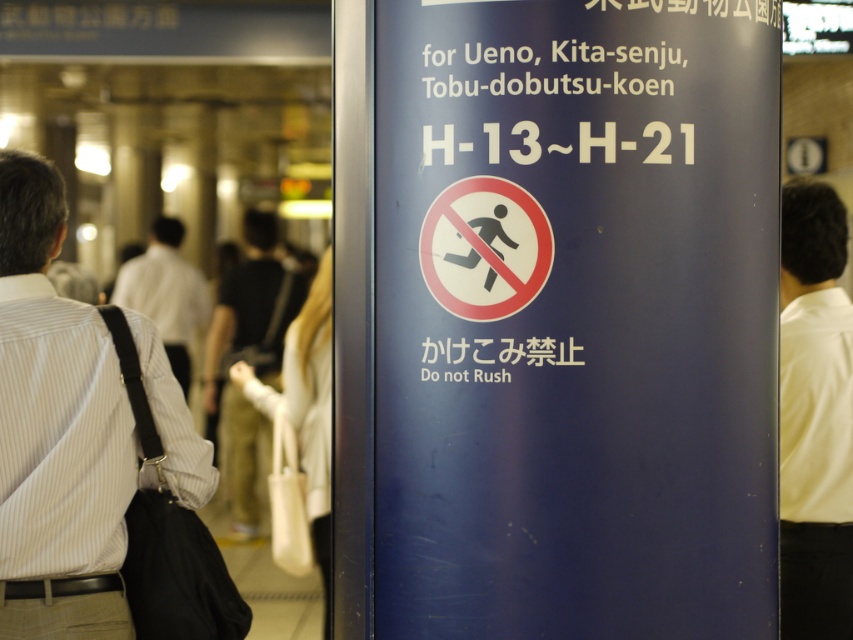
You are standing in a subway station and see a signboard with two people nearby. One is wearing a white striped shirt at left and the other a light brown leather jacket at center. According to their positions, which person is closer to the signboard?

The light brown leather jacket at center is closer to the signboard because the white striped shirt at left is positioned to the right of the light brown leather jacket at center, meaning the jacket is nearer to the signboard.

You are standing in a subway station and see a signboard with a white shirt at right and a light brown leather jacket at center. Which clothing item is closer to the top of the signboard?

The white shirt at right is positioned over the light brown leather jacket at center, so it is closer to the top of the signboard.

You are standing at the entrance of the subway station and see a signboard with a dark blue background. On the left side of the signboard, there is a white striped shirt at left, and at the center, there is a light brown leather jacket at center. If you want to place a small poster between them, how far apart should you position the poster from each object?

The white striped shirt at left is 18.05 feet from the light brown leather jacket at center. To place the poster between them, it should be positioned 9.025 feet away from both objects.